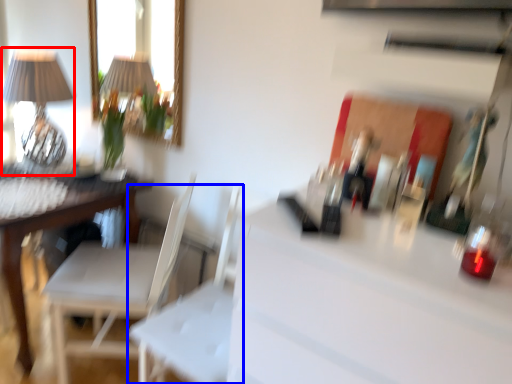
Question: Among these objects, which one is farthest to the camera, table lamp (highlighted by a red box) or swivel chair (highlighted by a blue box)?

Choices:
 (A) table lamp
 (B) swivel chair

Answer: (A)